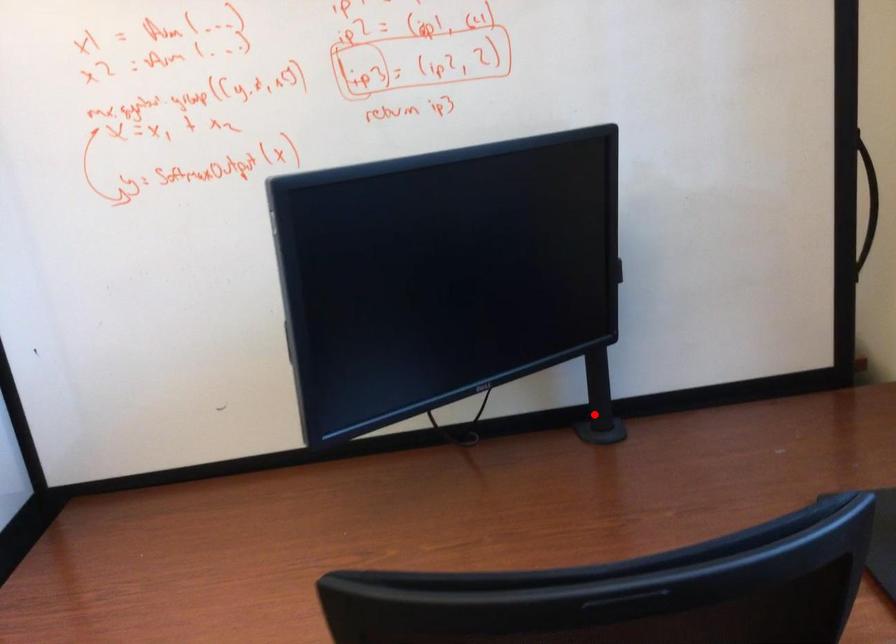
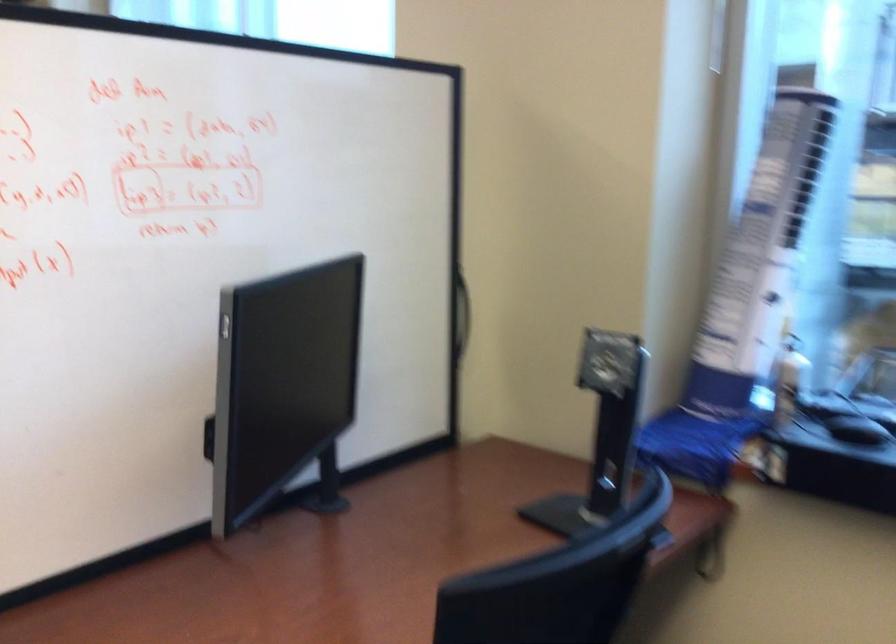
Question: I am providing you with two images of the same scene from different viewpoints. Given a red point in image1, look at the same physical point in image2. Is it:

Choices:
 (A) Closer to the viewpoint
 (B) Farther from the viewpoint

Answer: (B)